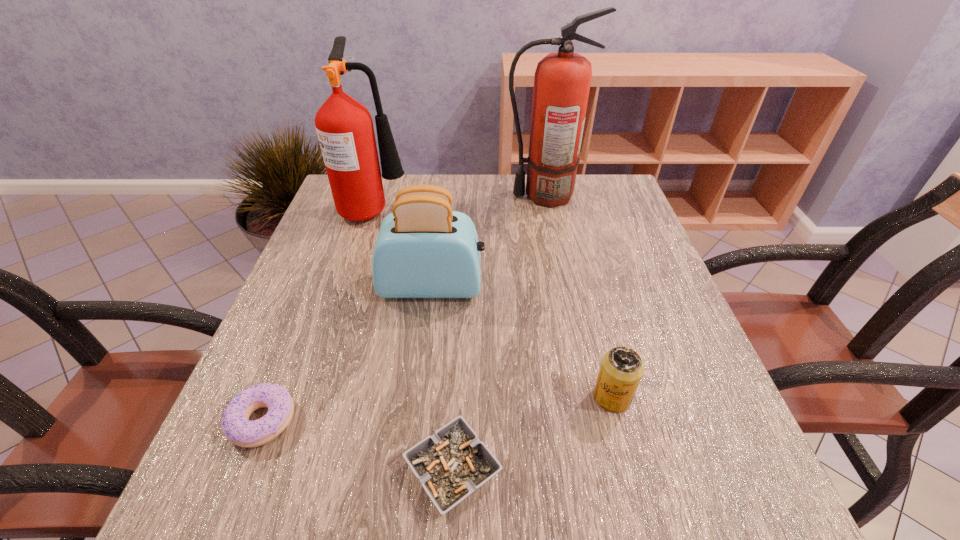
Where is `free space that satisfies the following two spatial constraints: 1. on the nozzle of the right fire extinguisher; 2. on the left side of the beer can`? The height and width of the screenshot is (540, 960). free space that satisfies the following two spatial constraints: 1. on the nozzle of the right fire extinguisher; 2. on the left side of the beer can is located at coordinates (584, 397).

Identify the location of vacant region that satisfies the following two spatial constraints: 1. at the nozzle of the shorter fire extinguisher; 2. on the back side of the ashtray. The image size is (960, 540). tap(292, 471).

Locate an element on the screen. This screenshot has width=960, height=540. free space that satisfies the following two spatial constraints: 1. at the nozzle of the ashtray; 2. on the left side of the second tallest object is located at coordinates (292, 471).

Where is `vacant space that satisfies the following two spatial constraints: 1. at the nozzle of the left fire extinguisher; 2. on the back side of the fourth tallest object`? The image size is (960, 540). vacant space that satisfies the following two spatial constraints: 1. at the nozzle of the left fire extinguisher; 2. on the back side of the fourth tallest object is located at coordinates (315, 397).